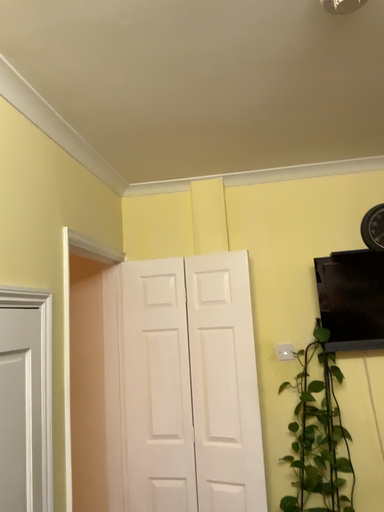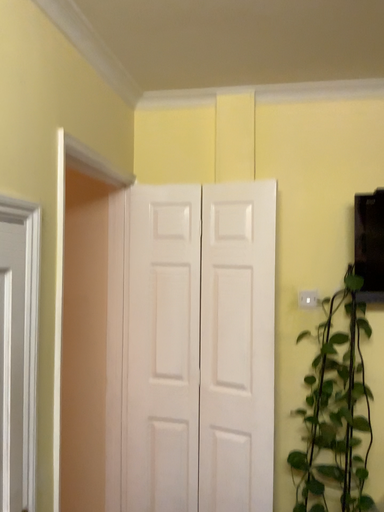
Question: How did the camera likely rotate when shooting the video?

Choices:
 (A) rotated downward
 (B) rotated upward

Answer: (A)